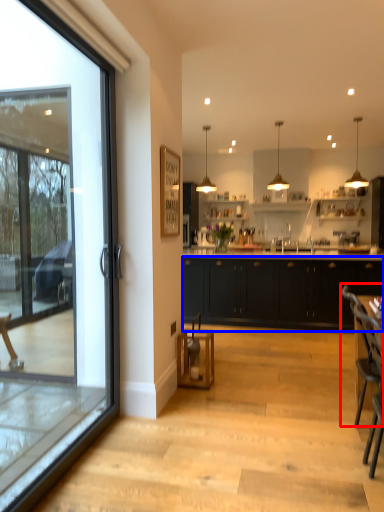
Question: Which point is further to the camera, armchair (highlighted by a red box) or cabinetry (highlighted by a blue box)?

Choices:
 (A) armchair
 (B) cabinetry

Answer: (B)